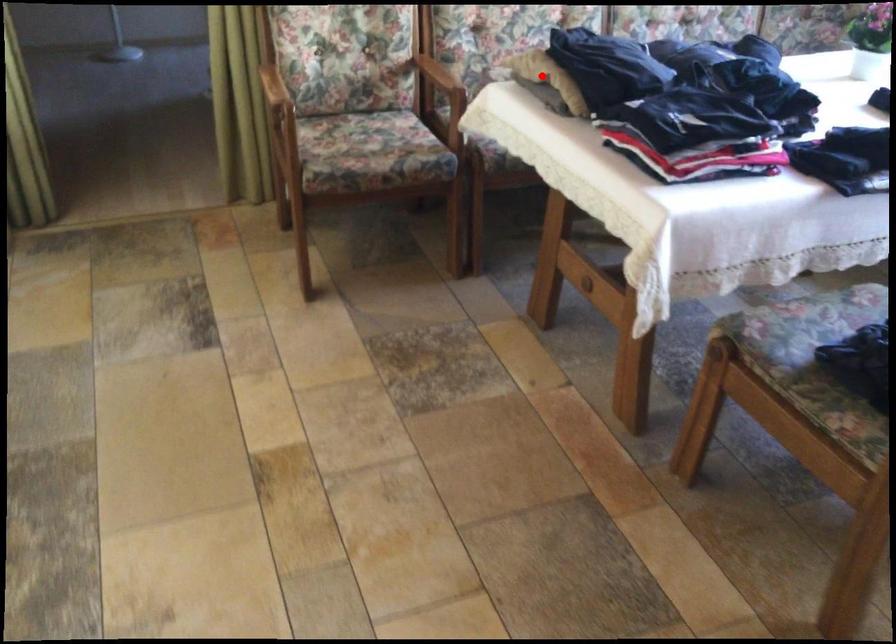
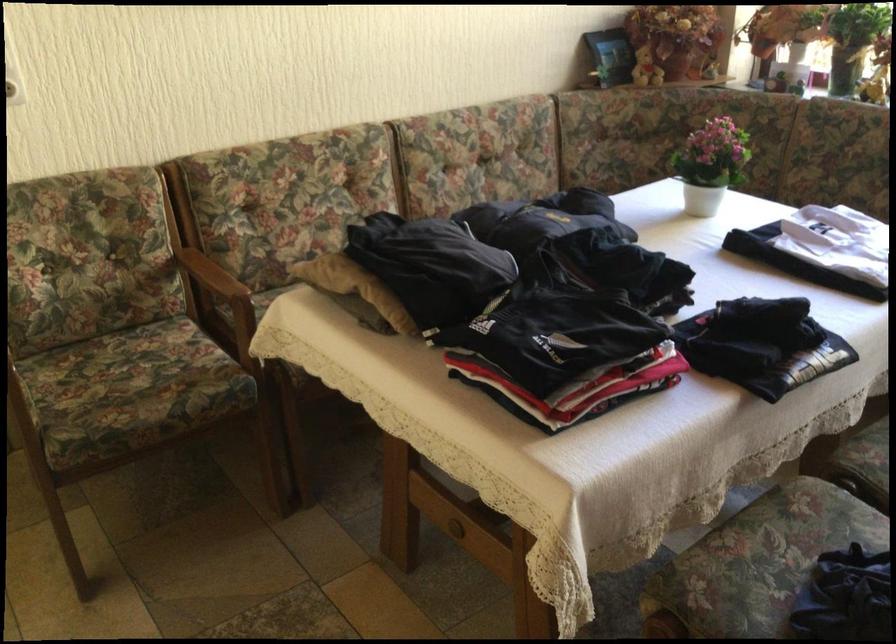
Question: I am providing you with two images of the same scene from different viewpoints. A red point is shown in image1. For the corresponding object point in image2, is it positioned nearer or farther from the camera?

Choices:
 (A) Nearer
 (B) Farther

Answer: (A)